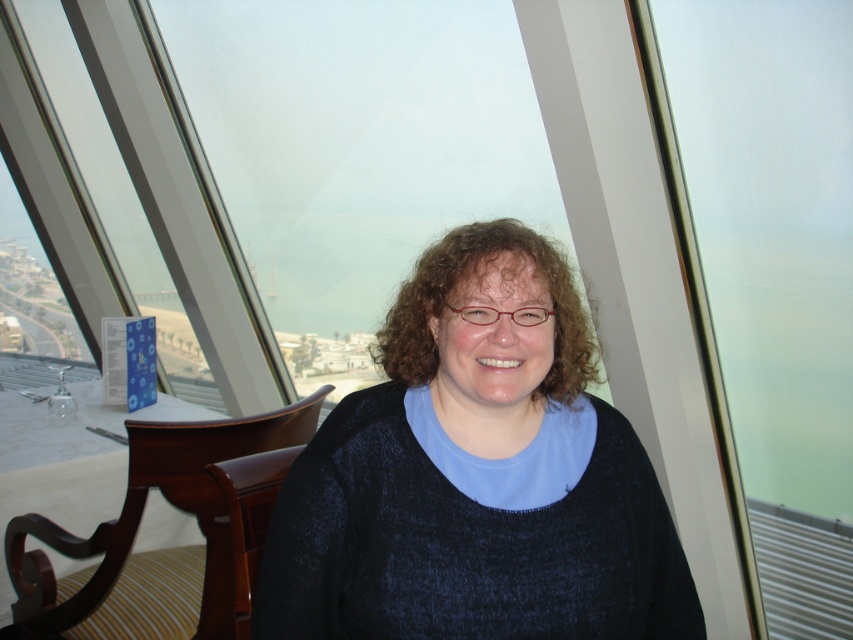
Is point (590, 595) in front of point (767, 508)?

Yes, point (590, 595) is closer to viewer.

Does black knitted sweater at center have a larger size compared to frosted glass window at center?

Actually, black knitted sweater at center might be smaller than frosted glass window at center.

Where is `black knitted sweater at center`? black knitted sweater at center is located at coordinates coord(476,476).

Does point (843, 508) come closer to viewer compared to point (143, 600)?

That is False.

Can you confirm if frosted glass window at center is shorter than mahogany wood chair at lower left?

Incorrect, frosted glass window at center's height does not fall short of mahogany wood chair at lower left's.

Locate an element on the screen. frosted glass window at center is located at coordinates (769, 276).

Is black knitted sweater at center bigger than mahogany wood chair at lower left?

Incorrect, black knitted sweater at center is not larger than mahogany wood chair at lower left.

Looking at this image, which is more to the left, black knitted sweater at center or mahogany wood chair at lower left?

From the viewer's perspective, mahogany wood chair at lower left appears more on the left side.

Identify the location of black knitted sweater at center. This screenshot has height=640, width=853. (476, 476).